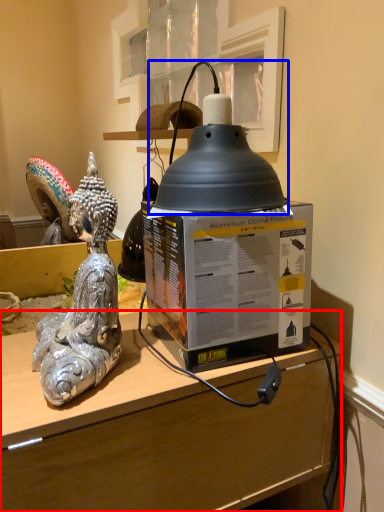
Question: Among these objects, which one is nearest to the camera, desk (highlighted by a red box) or oil lamp (highlighted by a blue box)?

Choices:
 (A) desk
 (B) oil lamp

Answer: (A)